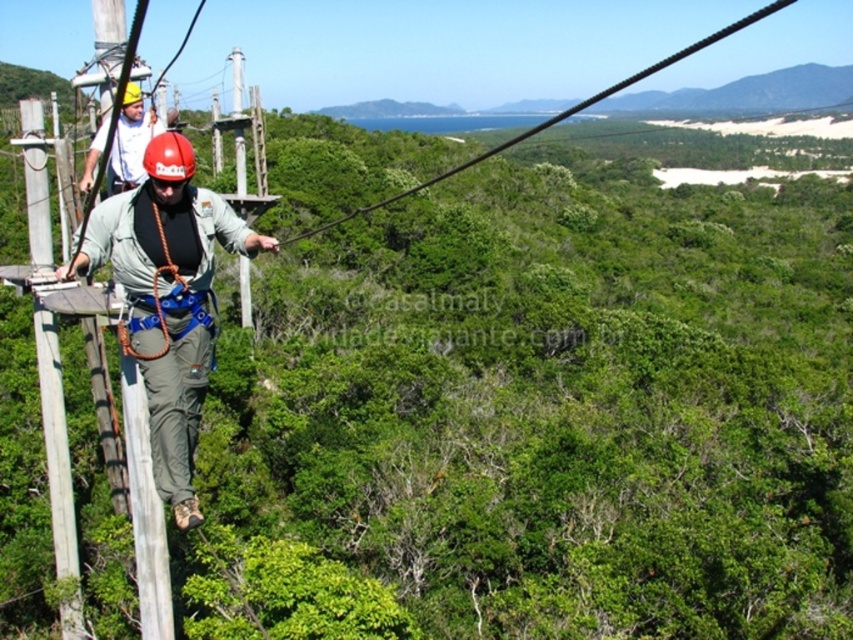
Is point (120, 148) farther from viewer compared to point (280, 241)?

No, (120, 148) is closer to viewer.

How much distance is there between matte yellow helmet at upper left and black wire at upper center?

984.50 feet

Who is more distant from viewer, (128, 81) or (424, 182)?

The point (424, 182) is more distant.

Locate an element on the screen. matte yellow helmet at upper left is located at coordinates pos(131,141).

Which is in front, point (178, 208) or point (395, 193)?

Point (178, 208)

Who is lower down, matte khaki pants at center or black wire at upper center?

matte khaki pants at center

Is point (184, 401) positioned before point (317, 232)?

Yes, it is in front of point (317, 232).

Where is `matte khaki pants at center`? The width and height of the screenshot is (853, 640). matte khaki pants at center is located at coordinates (167, 298).

Is matte khaki pants at center thinner than matte yellow helmet at upper left?

Correct, matte khaki pants at center's width is less than matte yellow helmet at upper left's.

Which is below, matte khaki pants at center or matte yellow helmet at upper left?

Positioned lower is matte khaki pants at center.

Consider the image. Who is more forward, [165,252] or [167,120]?

Point [165,252]

The width and height of the screenshot is (853, 640). I want to click on matte khaki pants at center, so 167,298.